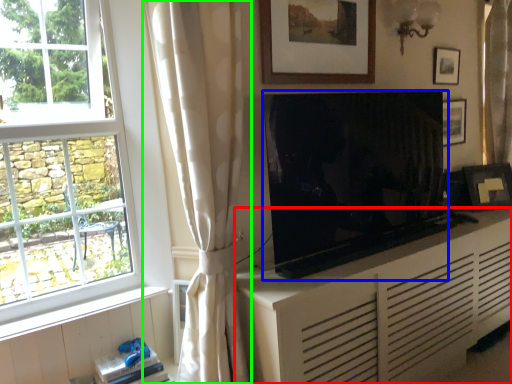
Question: Considering the real-world distances, which object is farthest from cabinetry (highlighted by a red box)? television (highlighted by a blue box) or curtain (highlighted by a green box)?

Choices:
 (A) television
 (B) curtain

Answer: (B)